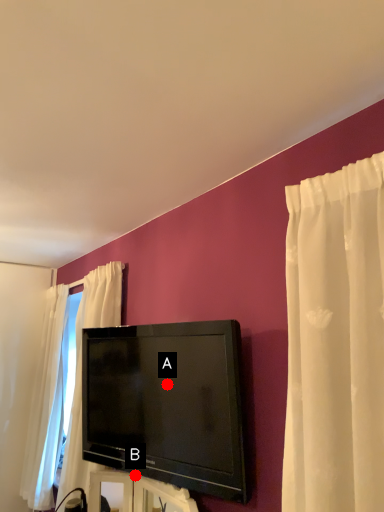
Question: Two points are circled on the image, labeled by A and B beside each circle. Which point is closer to the camera taking this photo?

Choices:
 (A) A is closer
 (B) B is closer

Answer: (A)